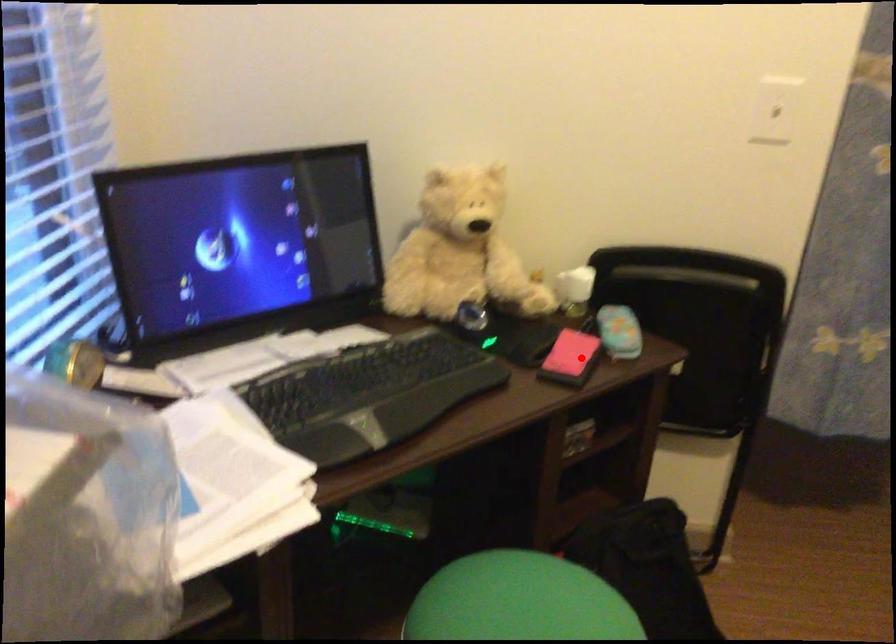
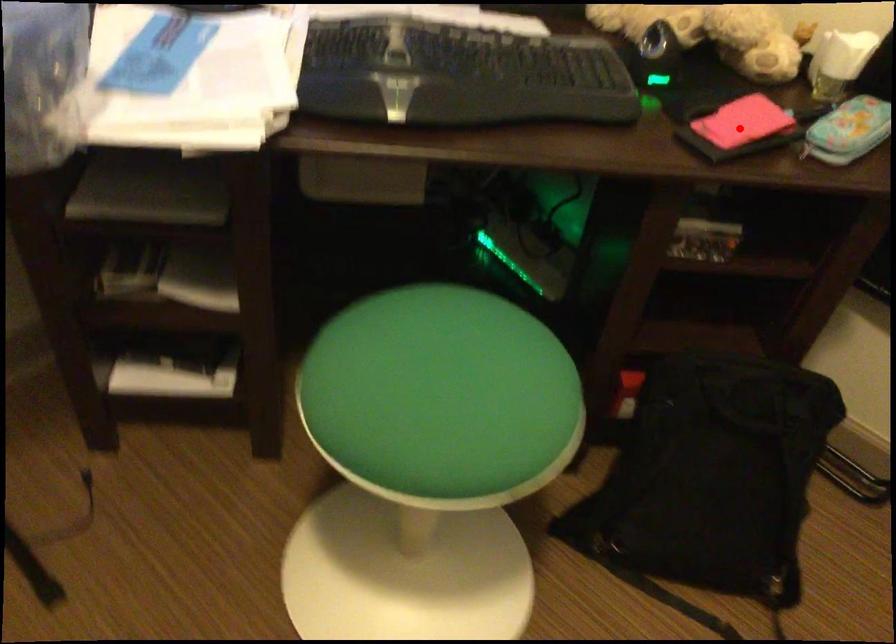
I am providing you with two images of the same scene from different viewpoints. A red point is marked on the first image and another point is marked on the second image. Are the points marked in image1 and image2 representing the same 3D position?

Yes